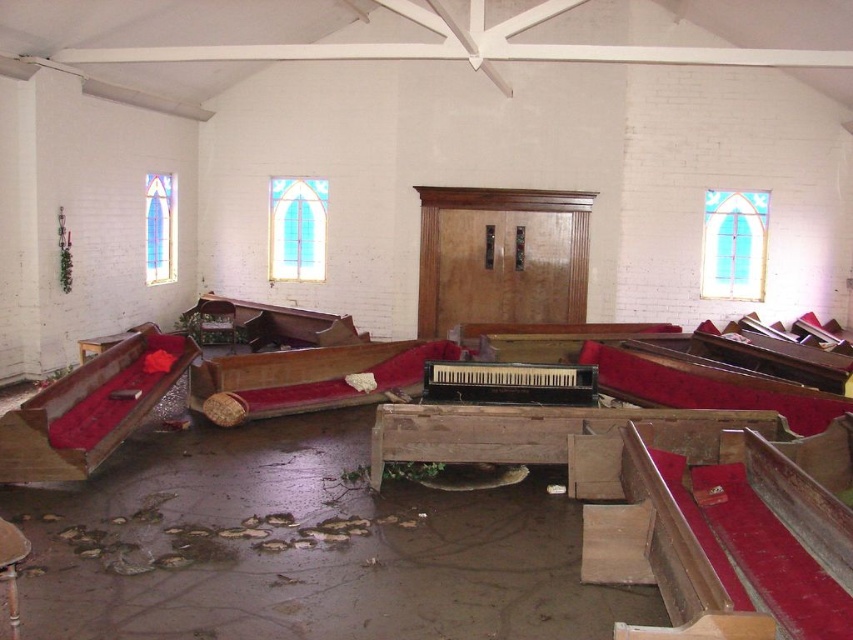
Question: Can you confirm if wooden polished bench at left is positioned above white painted wood beam at upper center?

Choices:
 (A) no
 (B) yes

Answer: (A)

Question: Does wooden polished bench at left appear on the right side of white painted wood beam at upper center?

Choices:
 (A) yes
 (B) no

Answer: (B)

Question: Among these objects, which one is farthest from the camera?

Choices:
 (A) white painted wood beam at upper center
 (B) wooden polished bench at left

Answer: (A)

Question: Can you confirm if wooden polished bench at left is positioned below white painted wood beam at upper center?

Choices:
 (A) yes
 (B) no

Answer: (A)

Question: Which of the following is the closest to the observer?

Choices:
 (A) (138, 396)
 (B) (596, 49)

Answer: (A)